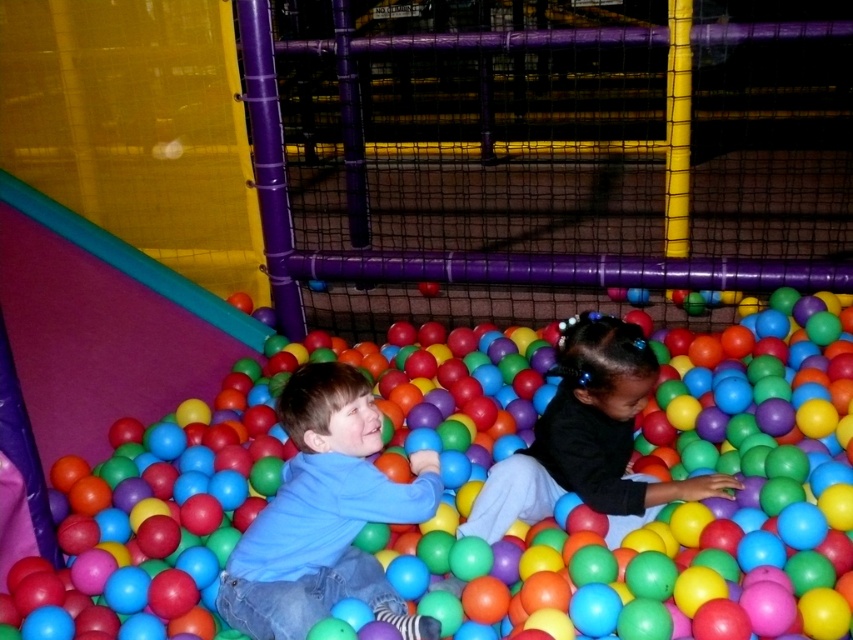
Can you confirm if rubber ball pit at center is positioned to the right of blue matte shirt at center?

Indeed, rubber ball pit at center is positioned on the right side of blue matte shirt at center.

Is point (833, 529) behind point (263, 593)?

That is True.

At what (x,y) coordinates should I click in order to perform the action: click on rubber ball pit at center. Please return your answer as a coordinate pair (x, y). The width and height of the screenshot is (853, 640). Looking at the image, I should click on (633, 483).

Which is below, rubber ball pit at center or black matte shirt at center?

black matte shirt at center is below.

Looking at this image, who is more distant from viewer, [427,348] or [633,381]?

Positioned behind is point [427,348].

You are a GUI agent. You are given a task and a screenshot of the screen. Output one action in this format:
    pyautogui.click(x=<x>, y=<y>)
    Task: Click on the rubber ball pit at center
    
    Given the screenshot: What is the action you would take?
    pyautogui.click(x=633, y=483)

I want to click on rubber ball pit at center, so click(633, 483).

Which is in front, point (270, 552) or point (599, 380)?

Point (270, 552) is in front.

Who is taller, blue matte shirt at center or black matte shirt at center?

Standing taller between the two is blue matte shirt at center.

Locate an element on the screen. blue matte shirt at center is located at coordinates (325, 515).

At what (x,y) coordinates should I click in order to perform the action: click on blue matte shirt at center. Please return your answer as a coordinate pair (x, y). This screenshot has height=640, width=853. Looking at the image, I should click on (325, 515).